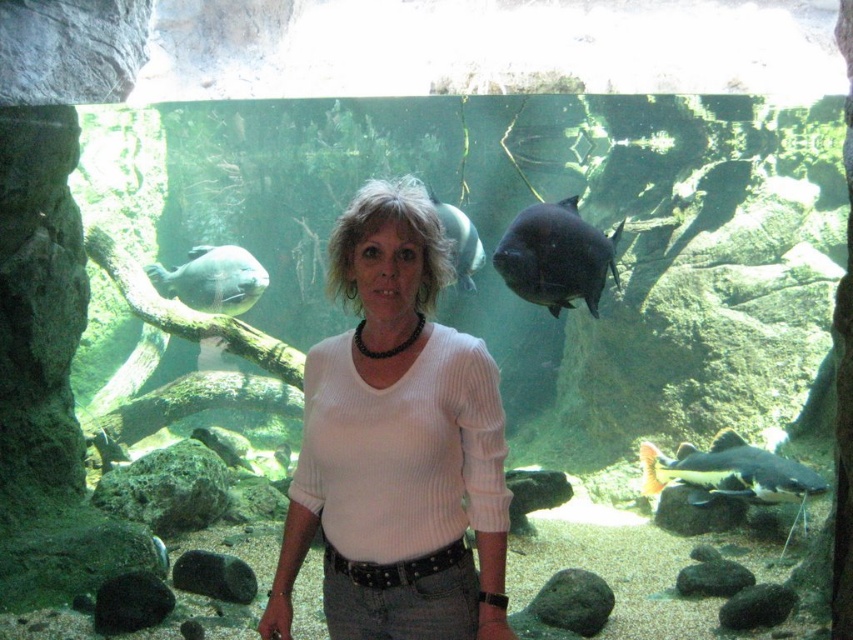
Question: Does white ribbed sweater at center come in front of black matte fish at center?

Choices:
 (A) no
 (B) yes

Answer: (B)

Question: Is orange and white textured catfish at lower right above shiny gray fish at left?

Choices:
 (A) no
 (B) yes

Answer: (A)

Question: Which object is positioned closest to the orange and white textured catfish at lower right?

Choices:
 (A) black matte fish at center
 (B) white ribbed sweater at center
 (C) shiny gray fish at left

Answer: (A)

Question: Where is black matte fish at center located in relation to orange and white textured catfish at lower right in the image?

Choices:
 (A) left
 (B) right

Answer: (A)

Question: Which point is closer to the camera?

Choices:
 (A) (453, 248)
 (B) (523, 252)

Answer: (B)

Question: Which object appears closest to the camera in this image?

Choices:
 (A) shiny gray fish at left
 (B) white ribbed sweater at center

Answer: (B)